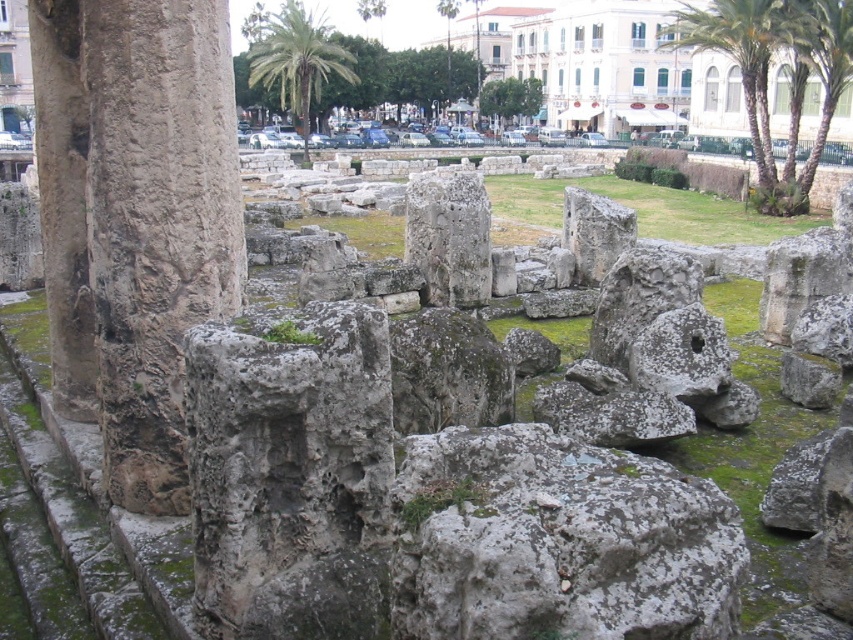
Question: Which object is farther from the camera taking this photo?

Choices:
 (A) rough stone column at left
 (B) green grass at center
 (C) green leafy palm tree at upper center
 (D) green leafy palm tree at center

Answer: (C)

Question: Which point is farther to the camera?

Choices:
 (A) (166, 324)
 (B) (763, 241)
 (C) (766, 3)

Answer: (C)

Question: Does rough stone column at left have a greater width compared to green grass at center?

Choices:
 (A) yes
 (B) no

Answer: (B)

Question: Considering the relative positions of green leafy palm tree at upper right and green leafy palm tree at upper center in the image provided, where is green leafy palm tree at upper right located with respect to green leafy palm tree at upper center?

Choices:
 (A) right
 (B) left

Answer: (A)

Question: Is rough stone column at left to the right of green leafy palm tree at upper center from the viewer's perspective?

Choices:
 (A) no
 (B) yes

Answer: (B)

Question: Among these points, which one is nearest to the camera?

Choices:
 (A) (140, 323)
 (B) (271, 38)
 (C) (851, 44)
 (D) (764, 141)

Answer: (A)